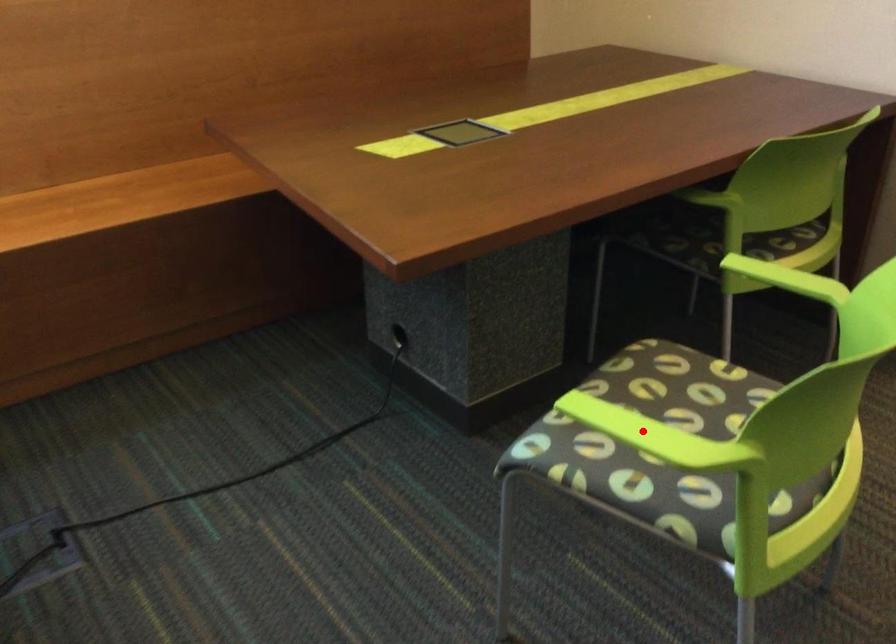
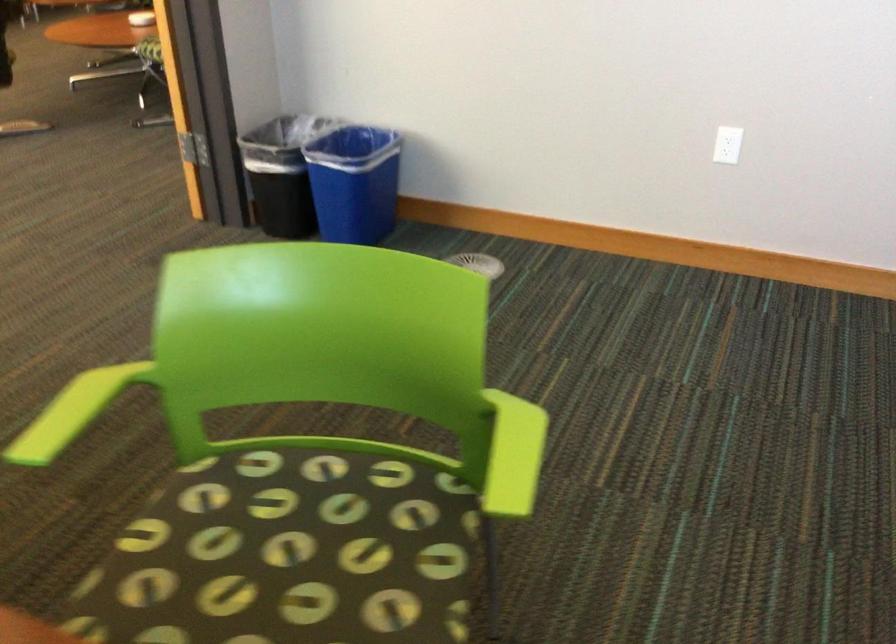
Where in the second image is the point corresponding to the highlighted location from the first image?

(513, 455)